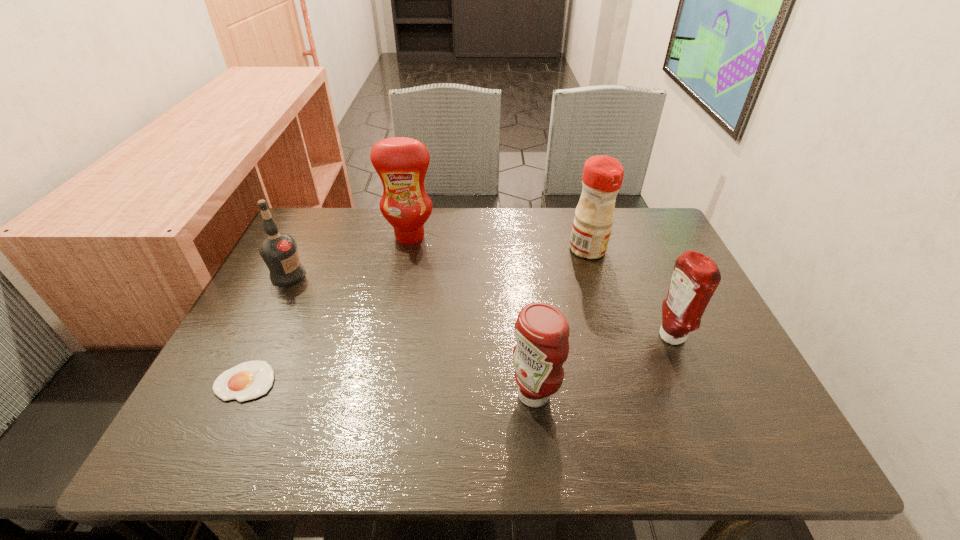
At what (x,y) coordinates should I click in order to perform the action: click on vacant area at the right edge. Please return your answer as a coordinate pair (x, y). Image resolution: width=960 pixels, height=540 pixels. Looking at the image, I should click on (738, 376).

You are a GUI agent. You are given a task and a screenshot of the screen. Output one action in this format:
    pyautogui.click(x=<x>, y=<y>)
    Task: Click on the vacant area at the far left corner
    The width and height of the screenshot is (960, 540).
    Given the screenshot: What is the action you would take?
    pyautogui.click(x=340, y=224)

At what (x,y) coordinates should I click in order to perform the action: click on free space at the far right corner of the desktop. Please return your answer as a coordinate pair (x, y). This screenshot has width=960, height=540. Looking at the image, I should click on (635, 230).

At what (x,y) coordinates should I click in order to perform the action: click on free space between the second object from right to left and the leftmost condiment. Please return your answer as a coordinate pair (x, y). This screenshot has height=540, width=960. Looking at the image, I should click on (499, 243).

Where is `free space between the egg yolk and the leftmost condiment`? Image resolution: width=960 pixels, height=540 pixels. free space between the egg yolk and the leftmost condiment is located at coordinates (327, 309).

Find the location of a particular element. empty location between the leftmost condiment and the egg yolk is located at coordinates (327, 309).

Locate an element on the screen. The height and width of the screenshot is (540, 960). empty space between the third object from left to right and the third condiment from left to right is located at coordinates (499, 243).

Locate an element on the screen. vacant area that lies between the fourth farthest object and the fifth object from left to right is located at coordinates (630, 293).

In order to click on free space between the rightmost condiment and the third farthest object in this screenshot , I will do `click(480, 306)`.

Locate an element on the screen. Image resolution: width=960 pixels, height=540 pixels. free space between the third nearest object and the fourth object from right to left is located at coordinates [540, 287].